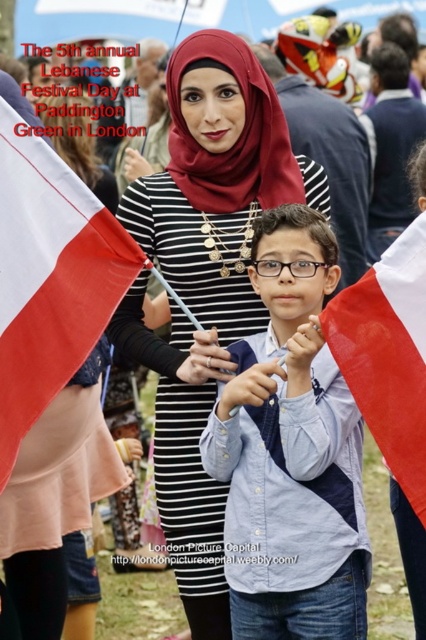
Which is above, blue cotton shirt at center or white fabric flag at right?

Positioned higher is white fabric flag at right.

Find the location of a particular element. blue cotton shirt at center is located at coordinates (290, 451).

Identify the location of blue cotton shirt at center. This screenshot has width=426, height=640. (290, 451).

Who is taller, matte black dress at center or white fabric flag at right?

matte black dress at center is taller.

Can you confirm if matte black dress at center is positioned to the right of white fabric flag at right?

In fact, matte black dress at center is to the left of white fabric flag at right.

Locate an element on the screen. matte black dress at center is located at coordinates (204, 282).

Identify the location of matte black dress at center. (204, 282).

Does white fabric flag at left have a greater height compared to white fabric flag at right?

Incorrect, white fabric flag at left's height is not larger of white fabric flag at right's.

Does white fabric flag at left have a lesser width compared to white fabric flag at right?

No, white fabric flag at left is not thinner than white fabric flag at right.

Which is in front, point (127, 237) or point (417, 408)?

Point (417, 408) is more forward.

Locate an element on the screen. This screenshot has width=426, height=640. white fabric flag at left is located at coordinates (49, 278).